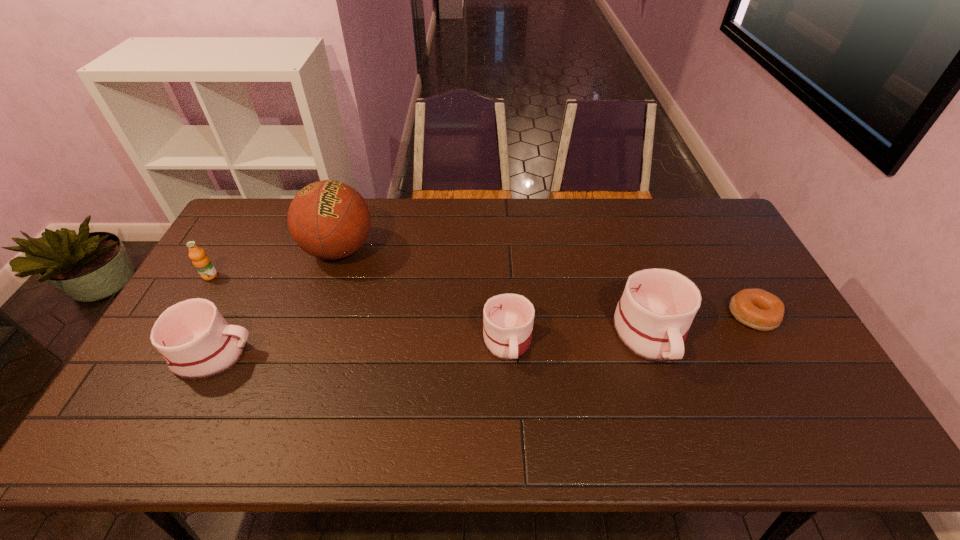
To ensure equal spacing by inserting another mug among them, please point out a vacant spot for this new mug. Please provide its 2D coordinates. Your answer should be formatted as a tuple, i.e. [(x, y)], where the tuple contains the x and y coordinates of a point satisfying the conditions above.

[(362, 347)]